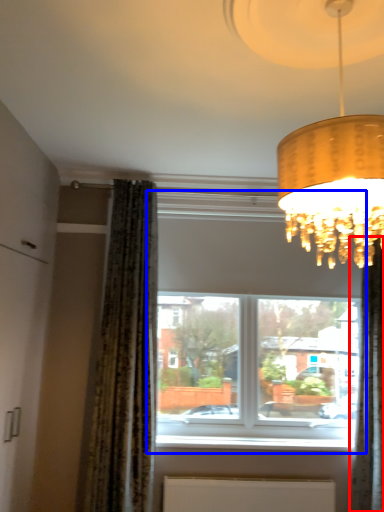
Question: Which point is closer to the camera, curtain (highlighted by a red box) or window (highlighted by a blue box)?

Choices:
 (A) curtain
 (B) window

Answer: (A)